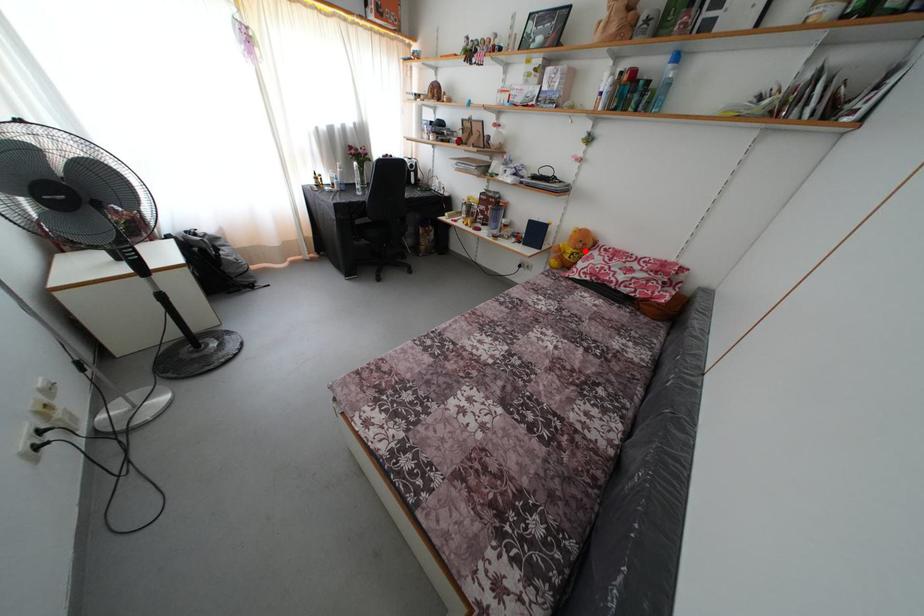
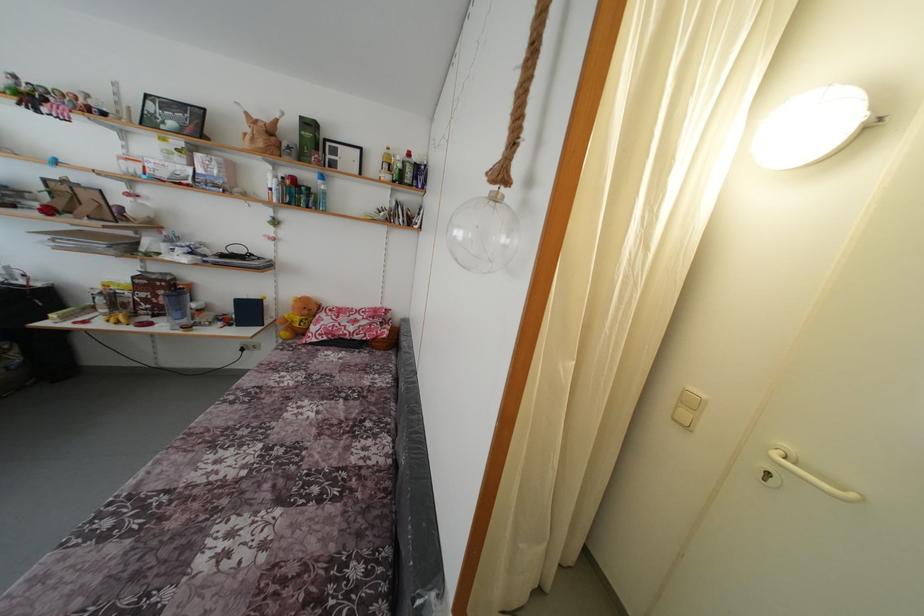
Question: I am providing you with two images of the same scene from different viewpoints. Given a red point in image1, look at the same physical point in image2. Is it:

Choices:
 (A) Closer to the viewpoint
 (B) Farther from the viewpoint

Answer: (B)